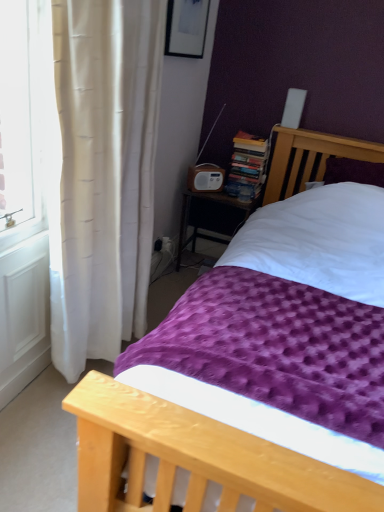
The height and width of the screenshot is (512, 384). What do you see at coordinates (186, 28) in the screenshot?
I see `matte black picture frame at upper center` at bounding box center [186, 28].

Image resolution: width=384 pixels, height=512 pixels. What do you see at coordinates (194, 458) in the screenshot? I see `purple textured blanket at center` at bounding box center [194, 458].

At what (x,y) coordinates should I click in order to perform the action: click on matte black picture frame at upper center. Please return your answer as a coordinate pair (x, y). Looking at the image, I should click on (186, 28).

Where is `picture frame located above the hardcover books at center (from a real-world perspective)`? The height and width of the screenshot is (512, 384). picture frame located above the hardcover books at center (from a real-world perspective) is located at coordinates (186, 28).

Based on the photo, is matte black picture frame at upper center spatially inside hardcover books at center, or outside of it?

matte black picture frame at upper center is not inside hardcover books at center, it's outside.

In the scene shown: From their relative heights in the image, would you say matte black picture frame at upper center is taller or shorter than hardcover books at center?

Considering their sizes, matte black picture frame at upper center has less height than hardcover books at center.

From the image's perspective, is wooden radio at center located above matte black picture frame at upper center?

No, from the image's perspective, wooden radio at center is not over matte black picture frame at upper center.

Does wooden radio at center turn towards matte black picture frame at upper center?

No, wooden radio at center does not turn towards matte black picture frame at upper center.

From a real-world perspective, which object stands above the other?

In real-world perspective, matte black picture frame at upper center is above.

Are wooden radio at center and matte black picture frame at upper center located far from each other?

Actually, wooden radio at center and matte black picture frame at upper center are a little close together.

From a real-world perspective, is white plastic radio at center under wooden radio at center?

Incorrect, from a real-world perspective, white plastic radio at center is higher than wooden radio at center.

The image size is (384, 512). In the image, there is a white plastic radio at center. In order to click on nightstand below it (from the image's perspective) in this screenshot , I will do `click(210, 201)`.

Is the surface of white plastic radio at center in direct contact with wooden radio at center?

No, white plastic radio at center is not touching wooden radio at center.

Looking at this image, is white plastic radio at center wider than wooden radio at center?

No, white plastic radio at center is not wider than wooden radio at center.

Could you tell me if white plastic radio at center is turned towards matte black picture frame at upper center?

No.

Is white plastic radio at center next to matte black picture frame at upper center and touching it?

No, white plastic radio at center is not next to matte black picture frame at upper center.

Which is further, (202, 176) or (186, 3)?

The point (202, 176) is more distant.

Based on the photo, which object is closer to the camera, white plastic radio at center or matte black picture frame at upper center?

matte black picture frame at upper center.

From a real-world perspective, is white plastic radio at center over purple textured blanket at center?

Yes, from a real-world perspective, white plastic radio at center is above purple textured blanket at center.

Could you tell me if white plastic radio at center is turned towards purple textured blanket at center?

Yes, white plastic radio at center faces towards purple textured blanket at center.

Between white plastic radio at center and purple textured blanket at center, which one has larger size?

Bigger between the two is purple textured blanket at center.

Looking at this image, which is nearer, (199, 178) or (269, 446)?

The point (269, 446) is closer to the camera.

From a real-world perspective, is purple textured blanket at center physically above wooden radio at center?

Yes, from a real-world perspective, purple textured blanket at center is on top of wooden radio at center.

Where is `bed lying on the right of wooden radio at center`? bed lying on the right of wooden radio at center is located at coordinates (194, 458).

Is purple textured blanket at center in front of or behind wooden radio at center in the image?

Visually, purple textured blanket at center is located in front of wooden radio at center.

Is wooden radio at center at the back of purple textured blanket at center?

No, purple textured blanket at center is not facing away from wooden radio at center.

Considering the sizes of objects purple textured blanket at center and hardcover books at center in the image provided, who is bigger, purple textured blanket at center or hardcover books at center?

Bigger between the two is purple textured blanket at center.

Between purple textured blanket at center and hardcover books at center, which one has less height?

With less height is hardcover books at center.

Between point (163, 492) and point (239, 161), which one is positioned in front?

Positioned in front is point (163, 492).

You are a GUI agent. You are given a task and a screenshot of the screen. Output one action in this format:
    pyautogui.click(x=<x>, y=<y>)
    Task: Click on the picture frame positioned vertically above the hardcover books at center (from a real-world perspective)
    This screenshot has width=384, height=512.
    Given the screenshot: What is the action you would take?
    pyautogui.click(x=186, y=28)

Where is `picture frame in front of the wooden radio at center`? The width and height of the screenshot is (384, 512). picture frame in front of the wooden radio at center is located at coordinates (186, 28).

Which object lies further to the anchor point wooden radio at center, purple textured blanket at center or white plastic radio at center?

purple textured blanket at center is further to wooden radio at center.

Considering their positions, is matte black picture frame at upper center positioned closer to purple textured blanket at center than wooden radio at center?

Based on the image, wooden radio at center appears to be nearer to purple textured blanket at center.

From the picture: From the image, which object appears to be farther from white plastic radio at center, hardcover books at center or wooden radio at center?

wooden radio at center is further to white plastic radio at center.

Which object lies nearer to the anchor point hardcover books at center, purple textured blanket at center or wooden radio at center?

wooden radio at center lies closer to hardcover books at center than the other object.

Estimate the real-world distances between objects in this image. Which object is further from white plastic radio at center, purple textured blanket at center or wooden radio at center?

purple textured blanket at center is positioned further to the anchor white plastic radio at center.

Which object lies further to the anchor point hardcover books at center, white plastic radio at center or wooden radio at center?

wooden radio at center is further to hardcover books at center.

Which object lies further to the anchor point purple textured blanket at center, hardcover books at center or wooden radio at center?

wooden radio at center.

Considering their positions, is matte black picture frame at upper center positioned further to purple textured blanket at center than white plastic radio at center?

The object further to purple textured blanket at center is matte black picture frame at upper center.

Locate an element on the screen. book between matte black picture frame at upper center and wooden radio at center vertically is located at coordinates (247, 166).

You are a GUI agent. You are given a task and a screenshot of the screen. Output one action in this format:
    pyautogui.click(x=<x>, y=<y>)
    Task: Click on the picture frame between purple textured blanket at center and wooden radio at center from front to back
    The height and width of the screenshot is (512, 384).
    Given the screenshot: What is the action you would take?
    pyautogui.click(x=186, y=28)

I want to click on nightstand located between purple textured blanket at center and white plastic radio at center in the depth direction, so click(x=210, y=201).

The height and width of the screenshot is (512, 384). Find the location of `book located between purple textured blanket at center and white plastic radio at center in the depth direction`. book located between purple textured blanket at center and white plastic radio at center in the depth direction is located at coordinates (247, 166).